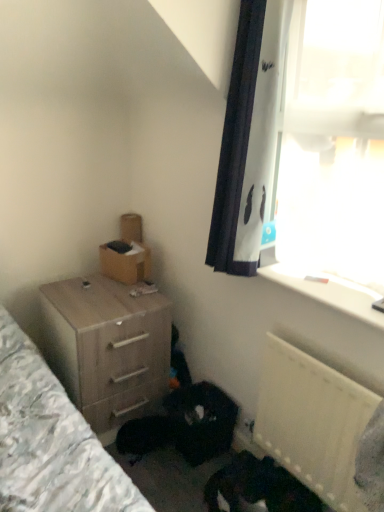
Where is `brown cardboard box at upper left`? The height and width of the screenshot is (512, 384). brown cardboard box at upper left is located at coordinates (126, 263).

Locate an element on the screen. This screenshot has width=384, height=512. white plastic window sill at upper right is located at coordinates (328, 291).

Locate an element on the screen. dark fur cat at lower center is located at coordinates click(x=258, y=486).

What is the approximate height of wooden chest of drawers at lower left?

The height of wooden chest of drawers at lower left is 68.79 centimeters.

You are a GUI agent. You are given a task and a screenshot of the screen. Output one action in this format:
    pyautogui.click(x=<x>, y=<y>)
    Task: Click on the white plastic radiator at lower right
    
    Given the screenshot: What is the action you would take?
    pyautogui.click(x=312, y=421)

This screenshot has height=512, width=384. Find the location of `brown cardboard box at upper left`. brown cardboard box at upper left is located at coordinates (126, 263).

From the image's perspective, which is below, white plastic radiator at lower right or dark fur cat at lower center?

dark fur cat at lower center appears lower in the image.

Between white plastic radiator at lower right and dark fur cat at lower center, which one has less height?

With less height is dark fur cat at lower center.

Does white plastic radiator at lower right touch dark fur cat at lower center?

No, white plastic radiator at lower right is not with dark fur cat at lower center.

The height and width of the screenshot is (512, 384). What are the coordinates of `the chest of drawers below the brown cardboard box at upper left (from the image's perspective)` in the screenshot? It's located at (107, 347).

Which is behind, point (132, 330) or point (113, 255)?

Positioned behind is point (113, 255).

Looking at this image, in the image, is wooden chest of drawers at lower left on the left side or the right side of brown cardboard box at upper left?

wooden chest of drawers at lower left is to the left of brown cardboard box at upper left.

Could you tell me if wooden chest of drawers at lower left is facing brown cardboard box at upper left?

No, wooden chest of drawers at lower left is not facing towards brown cardboard box at upper left.

Is white plastic window sill at upper right smaller than wooden chest of drawers at lower left?

Yes.

Locate an element on the screen. Image resolution: width=384 pixels, height=512 pixels. window sill that is in front of the wooden chest of drawers at lower left is located at coordinates (328, 291).

From the image's perspective, is wooden chest of drawers at lower left below dark fur cat at lower center?

No, from the image's perspective, wooden chest of drawers at lower left is not beneath dark fur cat at lower center.

Is wooden chest of drawers at lower left wider or thinner than dark fur cat at lower center?

Considering their sizes, wooden chest of drawers at lower left looks broader than dark fur cat at lower center.

Is point (78, 323) farther from camera compared to point (268, 486)?

That is True.

From the picture: Who is taller, wooden chest of drawers at lower left or white plastic window sill at upper right?

wooden chest of drawers at lower left is taller.

Between wooden chest of drawers at lower left and white plastic window sill at upper right, which one has smaller width?

With smaller width is white plastic window sill at upper right.

From a real-world perspective, which object rests below the other?

wooden chest of drawers at lower left, from a real-world perspective.

Is wooden chest of drawers at lower left to the left of white plastic window sill at upper right from the viewer's perspective?

Indeed, wooden chest of drawers at lower left is positioned on the left side of white plastic window sill at upper right.

Is dark fur cat at lower center bigger than white plastic radiator at lower right?

Correct, dark fur cat at lower center is larger in size than white plastic radiator at lower right.

Does point (233, 466) come farther from viewer compared to point (292, 442)?

That is True.

In the scene shown: Considering the sizes of dark fur cat at lower center and white plastic radiator at lower right in the image, is dark fur cat at lower center taller or shorter than white plastic radiator at lower right?

dark fur cat at lower center is shorter than white plastic radiator at lower right.

Considering the sizes of objects white plastic radiator at lower right and brown cardboard box at upper left in the image provided, who is thinner, white plastic radiator at lower right or brown cardboard box at upper left?

white plastic radiator at lower right is thinner.

Is brown cardboard box at upper left inside white plastic radiator at lower right?

Actually, brown cardboard box at upper left is outside white plastic radiator at lower right.

You are a GUI agent. You are given a task and a screenshot of the screen. Output one action in this format:
    pyautogui.click(x=<x>, y=<y>)
    Task: Click on the radiator below the brown cardboard box at upper left (from a real-world perspective)
    The height and width of the screenshot is (512, 384).
    Given the screenshot: What is the action you would take?
    pyautogui.click(x=312, y=421)

Identify the location of radiator on the right of dark fur cat at lower center. This screenshot has height=512, width=384. (312, 421).

Locate an element on the screen. box that is above the wooden chest of drawers at lower left (from a real-world perspective) is located at coordinates (126, 263).

Considering their positions, is brown cardboard box at upper left positioned closer to white plastic window sill at upper right than wooden chest of drawers at lower left?

wooden chest of drawers at lower left is positioned closer to the anchor white plastic window sill at upper right.

Estimate the real-world distances between objects in this image. Which object is closer to wooden chest of drawers at lower left, white plastic radiator at lower right or dark fur cat at lower center?

dark fur cat at lower center.

Estimate the real-world distances between objects in this image. Which object is further from white plastic radiator at lower right, brown cardboard box at upper left or dark fur cat at lower center?

brown cardboard box at upper left is positioned further to the anchor white plastic radiator at lower right.

Based on their spatial positions, is white plastic radiator at lower right or white plastic window sill at upper right further from dark fur cat at lower center?

white plastic window sill at upper right.

From the image, which object appears to be nearer to dark fur cat at lower center, white plastic radiator at lower right or brown cardboard box at upper left?

The object closer to dark fur cat at lower center is white plastic radiator at lower right.

Estimate the real-world distances between objects in this image. Which object is further from white plastic window sill at upper right, wooden chest of drawers at lower left or white plastic radiator at lower right?

wooden chest of drawers at lower left is further to white plastic window sill at upper right.

Considering their positions, is dark fur cat at lower center positioned closer to white plastic window sill at upper right than white plastic radiator at lower right?

Based on the image, white plastic radiator at lower right appears to be nearer to white plastic window sill at upper right.

When comparing their distances from wooden chest of drawers at lower left, does white plastic window sill at upper right or brown cardboard box at upper left seem further?

white plastic window sill at upper right.

What are the coordinates of `radiator between brown cardboard box at upper left and dark fur cat at lower center in the up-down direction` in the screenshot? It's located at (312, 421).

Identify the location of animal between wooden chest of drawers at lower left and white plastic window sill at upper right. This screenshot has height=512, width=384. (258, 486).

At what (x,y) coordinates should I click in order to perform the action: click on window sill between brown cardboard box at upper left and dark fur cat at lower center vertically. Please return your answer as a coordinate pair (x, y). This screenshot has height=512, width=384. Looking at the image, I should click on (328, 291).

Identify the location of radiator between brown cardboard box at upper left and white plastic window sill at upper right in the horizontal direction. (312, 421).